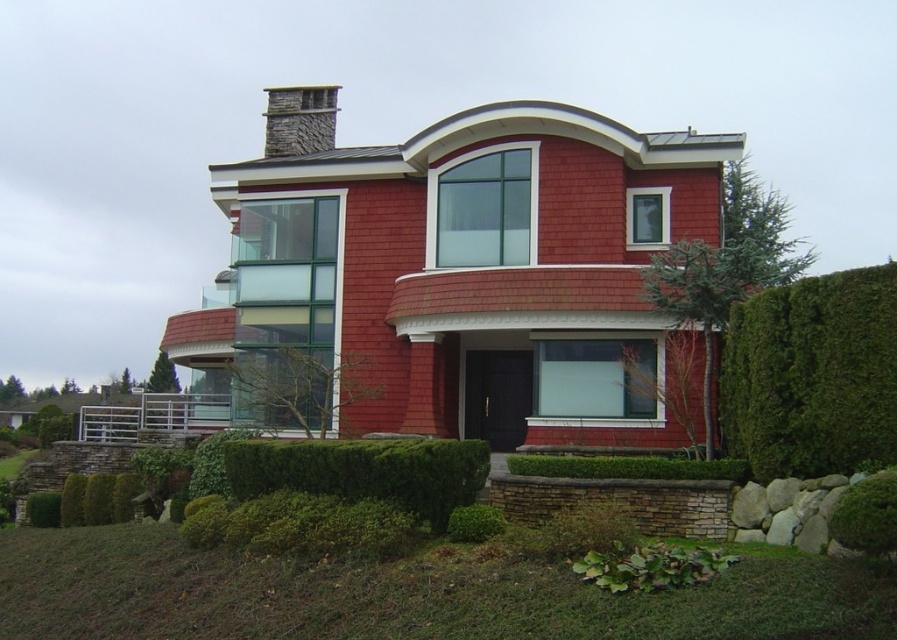
You are standing in front of the modern two story house with a red shingle exterior. You notice a point at coordinate (812, 376). What object is located at that point?

The point at coordinate (812, 376) corresponds to the green leafy hedge at right.

You are standing at the center of the image. Which direction should you look to see the green leafy hedge at right?

The green leafy hedge at right is located at the right side of the image, so you should look to your right to see it.

You are standing in front of the modern two story house with a red shingle exterior. You see two points marked on the image, point 1 at coordinates point (294,490) and point 2 at coordinates point (290,88). Which point is closer to you?

Point (294,490) is in front of point (290,88), so it is closer to you.